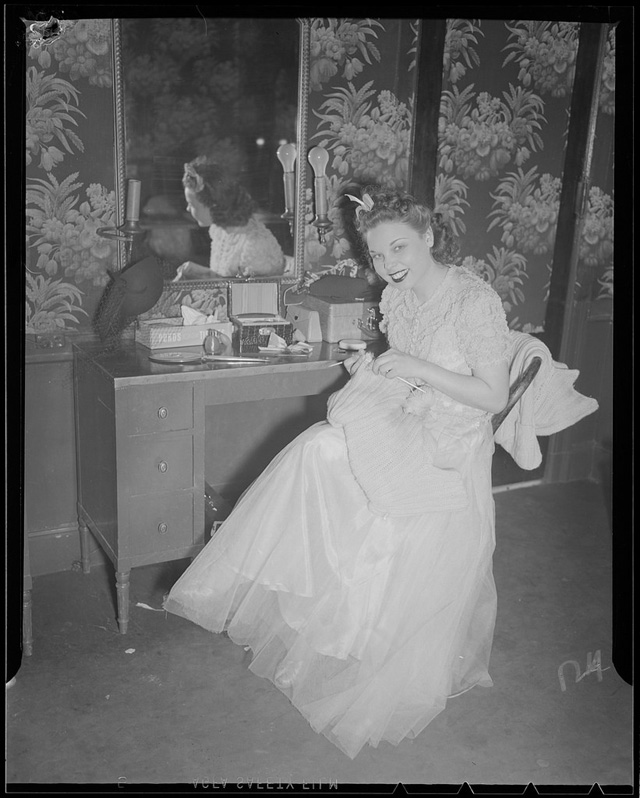
This screenshot has width=640, height=798. In order to click on chair in this screenshot , I will do `click(516, 393)`.